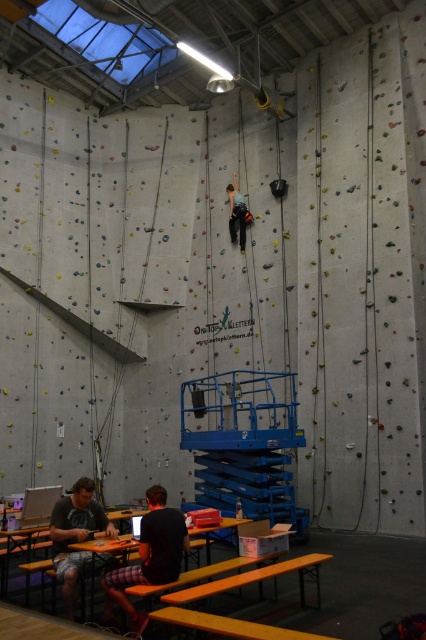
You are a photographer standing at the entrance of the climbing facility. You want to take a photo that includes both the black cotton shirt at lower center and the green fabric climbing harness at center. Which object should you focus on first to ensure both are in clear view?

The black cotton shirt at lower center is closer to the viewer than the green fabric climbing harness at center, so you should focus on the black cotton shirt at lower center first to ensure both are in clear view.

You are a climber preparing to ascend the climbing wall in the indoor facility. You notice a black cotton shirt at lower center located at point (150, 554). If you want to avoid stepping on it, which direction should you move relative to the shirt?

To avoid stepping on the black cotton shirt at lower center at point (150, 554), you should move away from that location, perhaps upwards or to the sides along the climbing wall.